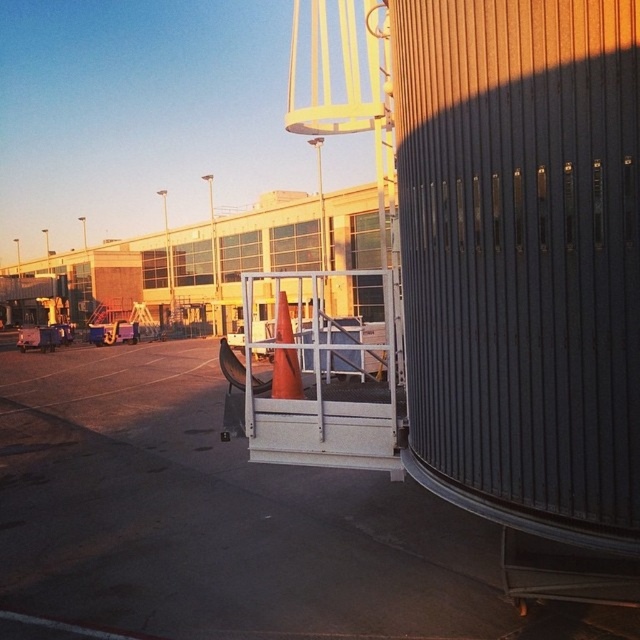
Question: Is orange cone at center to the left of orange matte traffic cone at center from the viewer's perspective?

Choices:
 (A) no
 (B) yes

Answer: (B)

Question: Can you confirm if orange cone at center is wider than orange matte traffic cone at center?

Choices:
 (A) yes
 (B) no

Answer: (A)

Question: Can you confirm if orange cone at center is thinner than orange matte traffic cone at center?

Choices:
 (A) no
 (B) yes

Answer: (A)

Question: Among these objects, which one is farthest from the camera?

Choices:
 (A) orange cone at center
 (B) orange matte traffic cone at center

Answer: (B)